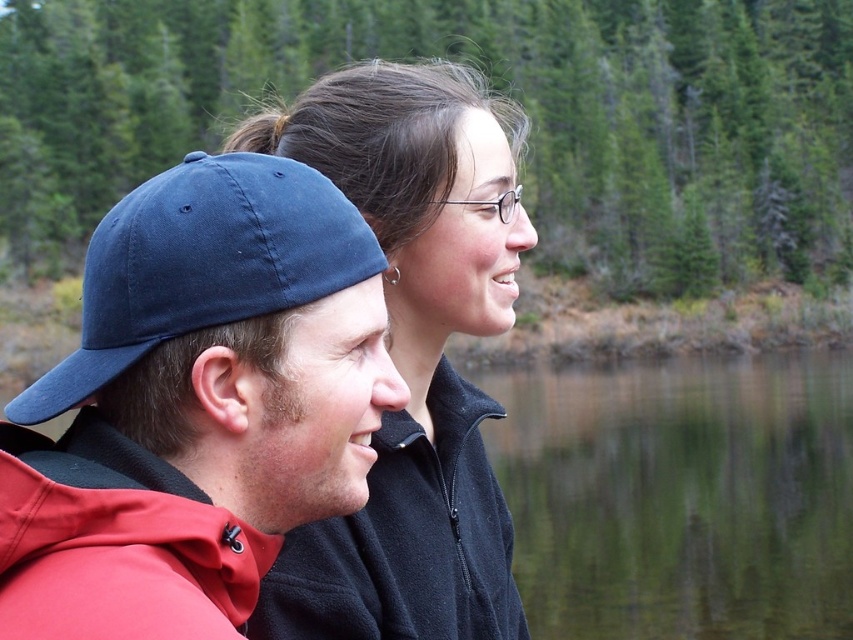
Question: Which object is the farthest from the navy blue fabric baseball cap at left?

Choices:
 (A) matte black jacket at center
 (B) green reflective water at center

Answer: (B)

Question: Estimate the real-world distances between objects in this image. Which object is closer to the matte black jacket at center?

Choices:
 (A) green reflective water at center
 (B) navy blue fabric baseball cap at left

Answer: (B)

Question: Can you confirm if matte black jacket at center is wider than green reflective water at center?

Choices:
 (A) yes
 (B) no

Answer: (B)

Question: Observing the image, what is the correct spatial positioning of matte black jacket at center in reference to green reflective water at center?

Choices:
 (A) below
 (B) above

Answer: (B)

Question: Does green reflective water at center have a lesser width compared to navy blue fabric baseball cap at left?

Choices:
 (A) no
 (B) yes

Answer: (A)

Question: Which object is the closest to the matte black jacket at center?

Choices:
 (A) green reflective water at center
 (B) navy blue fabric baseball cap at left

Answer: (B)